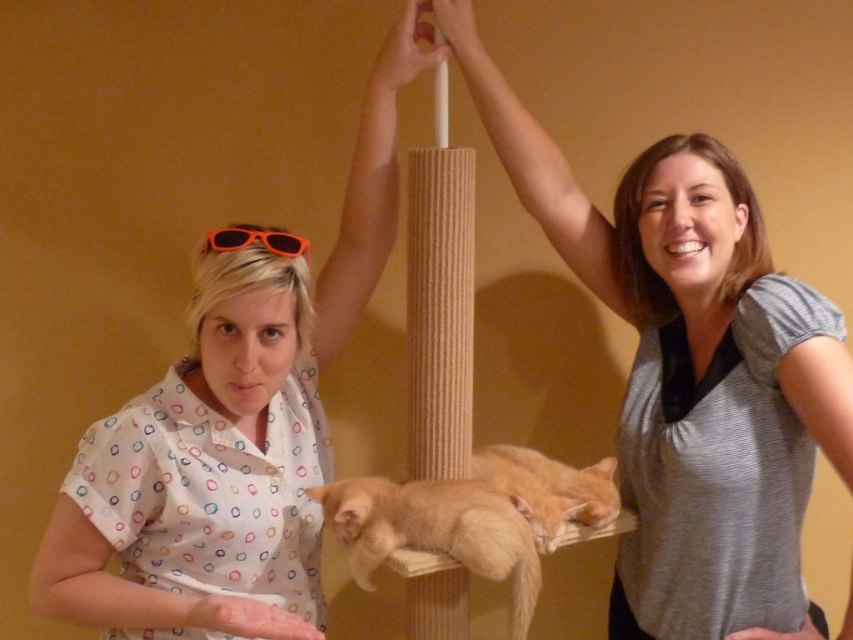
Based on the photo, between gray matte shirt at center and orange fur cat at center, which one has less height?

Standing shorter between the two is orange fur cat at center.

Who is positioned more to the right, gray matte shirt at center or orange fur cat at center?

gray matte shirt at center

Is point (618, 288) closer to camera compared to point (459, 536)?

No, it is behind (459, 536).

The height and width of the screenshot is (640, 853). In order to click on gray matte shirt at center in this screenshot , I will do `click(631, 212)`.

Can you confirm if white dotted shirt at upper left is smaller than orange fur cat at center?

No, white dotted shirt at upper left is not smaller than orange fur cat at center.

Can you confirm if white dotted shirt at upper left is taller than orange fur cat at center?

Yes, white dotted shirt at upper left is taller than orange fur cat at center.

Does point (268, 339) come behind point (344, 529)?

That is False.

Identify the location of white dotted shirt at upper left. (231, 428).

Which is below, gray matte shirt at center or orange plastic sunglasses at upper center?

gray matte shirt at center is below.

Measure the distance between gray matte shirt at center and camera.

They are 3.62 feet apart.

What do you see at coordinates (631, 212) in the screenshot? I see `gray matte shirt at center` at bounding box center [631, 212].

The image size is (853, 640). What are the coordinates of `gray matte shirt at center` in the screenshot? It's located at (631, 212).